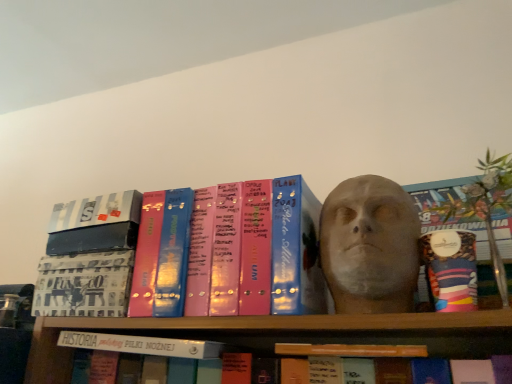
Question: From the image's perspective, is green leafy plant at upper right positioned above or below metallic silver book at upper left, which appears as the second book when viewed from the left?

Choices:
 (A) above
 (B) below

Answer: (A)

Question: Is point (472, 200) closer or farther from the camera than point (58, 221)?

Choices:
 (A) closer
 (B) farther

Answer: (A)

Question: Considering the real-world distances, which object is closest to the patterned fabric book at center, the 5th book in the right-to-left sequence?

Choices:
 (A) metallic silver book at upper left, which appears as the fourth book when viewed from the right
 (B) white matte book at center, the third book viewed from the left
 (C) green leafy plant at upper right
 (D) matte gray sculpture at center
 (E) matte pink binder at center, arranged as the second book when viewed from the right

Answer: (B)

Question: Considering the real-world distances, which object is farthest from the metallic silver book at upper left, which appears as the second book when viewed from the left?

Choices:
 (A) orange matte book at center, which is the 1th book from right to left
 (B) green leafy plant at upper right
 (C) matte gray sculpture at center
 (D) white matte book at center, marked as the 3th book in a right-to-left arrangement
 (E) matte pink binder at center, arranged as the second book when viewed from the right

Answer: (B)